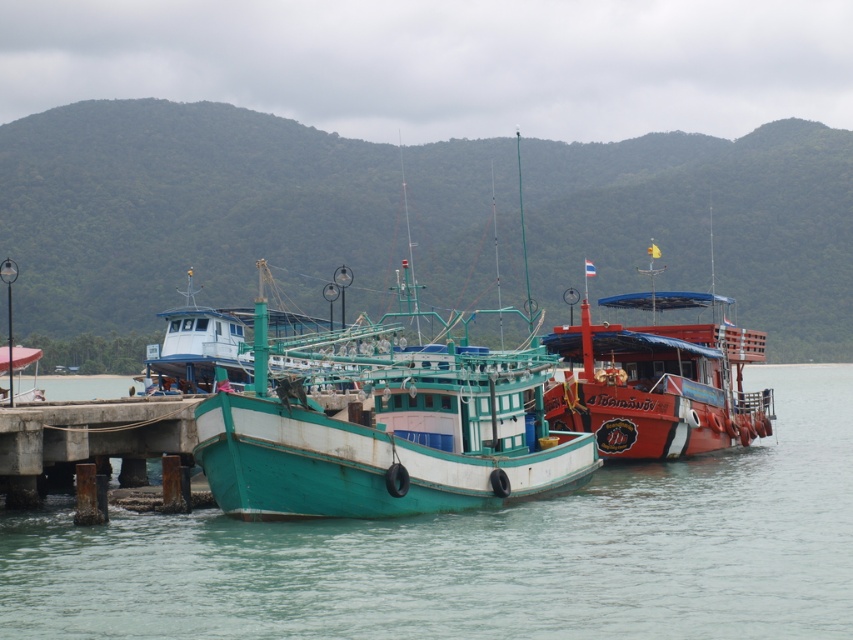
Does green matte water at center appear over teal wooden boat at center?

Incorrect, green matte water at center is not positioned above teal wooden boat at center.

Does point (722, 515) come farther from viewer compared to point (473, 452)?

That is True.

At what (x,y) coordinates should I click in order to perform the action: click on green matte water at center. Please return your answer as a coordinate pair (x, y). The width and height of the screenshot is (853, 640). Looking at the image, I should click on (485, 554).

Can you confirm if green matte water at center is wider than concrete pier at lower left?

Correct, the width of green matte water at center exceeds that of concrete pier at lower left.

Consider the image. Does green matte water at center have a larger size compared to concrete pier at lower left?

Yes.

Locate an element on the screen. This screenshot has height=640, width=853. green matte water at center is located at coordinates (485, 554).

Looking at this image, can you confirm if green matte water at center is positioned to the right of shiny red boat at right?

Incorrect, green matte water at center is not on the right side of shiny red boat at right.

Is point (805, 477) positioned before point (596, 433)?

No, it is behind (596, 433).

Does point (817, 467) come closer to viewer compared to point (593, 401)?

No, (817, 467) is behind (593, 401).

Identify the location of green matte water at center. (485, 554).